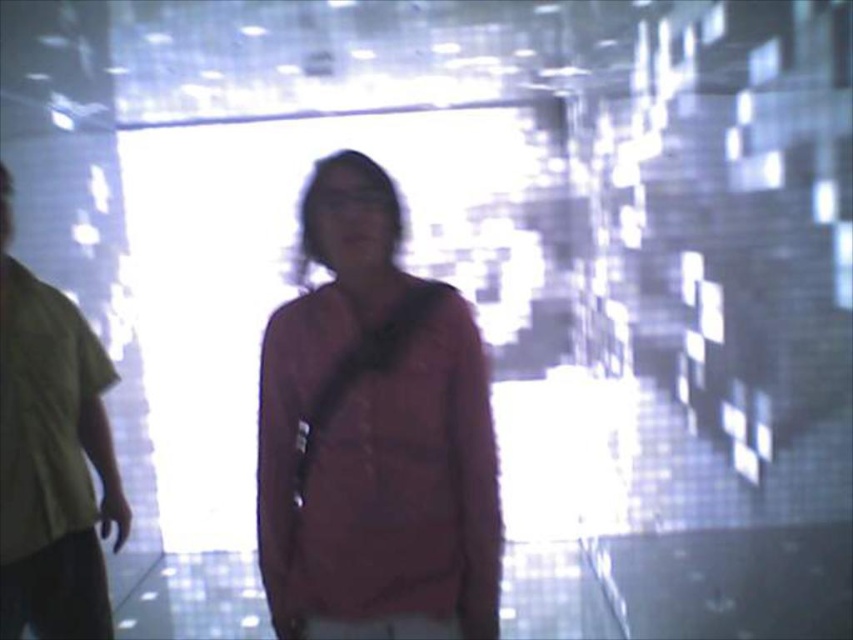
Can you confirm if matte red shirt at center is smaller than green fabric shirt at left?

Yes.

Is point (302, 403) more distant than point (48, 301)?

No.

The width and height of the screenshot is (853, 640). I want to click on matte red shirt at center, so click(x=374, y=435).